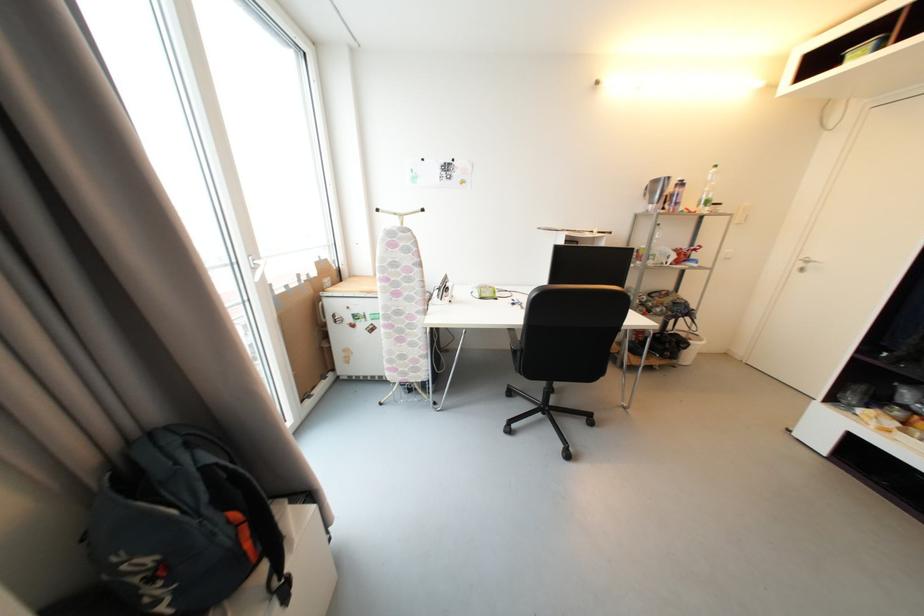
Describe the element at coordinates (805, 264) in the screenshot. I see `the silver door handle` at that location.